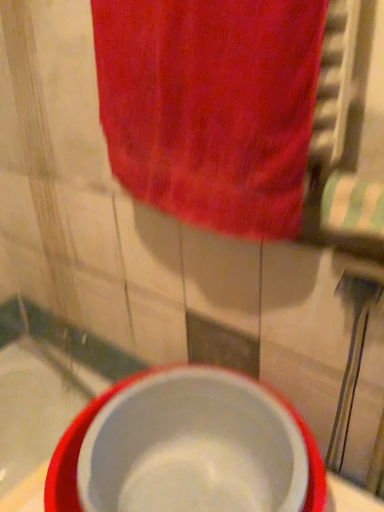
This screenshot has width=384, height=512. What do you see at coordinates (186, 449) in the screenshot? I see `white plastic basin at center` at bounding box center [186, 449].

The width and height of the screenshot is (384, 512). In order to click on red cotton towel at upper center in this screenshot , I will do pos(211,106).

From the image's perspective, between white plastic basin at center and white glossy bath at lower left, who is located below?

white plastic basin at center, from the image's perspective.

Does white plastic basin at center have a greater height compared to white glossy bath at lower left?

Yes, white plastic basin at center is taller than white glossy bath at lower left.

From a real-world perspective, is white plastic basin at center physically located above or below white glossy bath at lower left?

From a real-world perspective, white plastic basin at center is physically above white glossy bath at lower left.

Measure the distance between white plastic basin at center and white glossy bath at lower left.

They are 24.67 inches apart.

Consider the image. Considering the relative sizes of white glossy bath at lower left and red cotton towel at upper center in the image provided, is white glossy bath at lower left thinner than red cotton towel at upper center?

Incorrect, the width of white glossy bath at lower left is not less than that of red cotton towel at upper center.

Is white glossy bath at lower left positioned with its back to red cotton towel at upper center?

No, white glossy bath at lower left is not facing the opposite direction of red cotton towel at upper center.

From a real-world perspective, does white glossy bath at lower left sit lower than red cotton towel at upper center?

Indeed, from a real-world perspective, white glossy bath at lower left is positioned beneath red cotton towel at upper center.

Is white glossy bath at lower left to the right of red cotton towel at upper center from the viewer's perspective?

In fact, white glossy bath at lower left is to the left of red cotton towel at upper center.

Does point (222, 511) come in front of point (94, 22)?

No, it is not.

Is white plastic basin at center taller or shorter than red cotton towel at upper center?

Considering their sizes, white plastic basin at center has less height than red cotton towel at upper center.

Considering the sizes of white plastic basin at center and red cotton towel at upper center in the image, is white plastic basin at center wider or thinner than red cotton towel at upper center?

In the image, white plastic basin at center appears to be wider than red cotton towel at upper center.

From a real-world perspective, does white plastic basin at center sit lower than red cotton towel at upper center?

Yes, from a real-world perspective, white plastic basin at center is under red cotton towel at upper center.

Is red cotton towel at upper center not within white glossy bath at lower left?

Yes.

From the picture: Is red cotton towel at upper center positioned with its back to white glossy bath at lower left?

No, white glossy bath at lower left is not at the back of red cotton towel at upper center.

Considering the sizes of objects red cotton towel at upper center and white glossy bath at lower left in the image provided, who is bigger, red cotton towel at upper center or white glossy bath at lower left?

white glossy bath at lower left.

Are red cotton towel at upper center and white glossy bath at lower left making contact?

red cotton towel at upper center and white glossy bath at lower left are not in contact.

From a real-world perspective, is white glossy bath at lower left physically located above or below white plastic basin at center?

In terms of real-world spatial position, white glossy bath at lower left is below white plastic basin at center.

Does white glossy bath at lower left have a larger size compared to white plastic basin at center?

Actually, white glossy bath at lower left might be smaller than white plastic basin at center.

Relative to white plastic basin at center, is white glossy bath at lower left in front or behind?

Clearly, white glossy bath at lower left is behind white plastic basin at center.

There is a white plastic basin at center. Find the location of `towel above it (from a real-world perspective)`. towel above it (from a real-world perspective) is located at coordinates (211, 106).

In the scene shown: Is red cotton towel at upper center oriented away from white plastic basin at center?

No, red cotton towel at upper center is not facing the opposite direction of white plastic basin at center.

Which of these two, red cotton towel at upper center or white plastic basin at center, stands shorter?

With less height is white plastic basin at center.

Is the position of red cotton towel at upper center less distant than that of white plastic basin at center?

Yes, the depth of red cotton towel at upper center is less than that of white plastic basin at center.

This screenshot has height=512, width=384. I want to click on basin that appears in front of the white glossy bath at lower left, so click(x=186, y=449).

At what (x,y) coordinates should I click in order to perform the action: click on towel on the right of white glossy bath at lower left. Please return your answer as a coordinate pair (x, y). Looking at the image, I should click on (211, 106).

Based on their spatial positions, is white glossy bath at lower left or red cotton towel at upper center closer to white plastic basin at center?

The object closer to white plastic basin at center is red cotton towel at upper center.

Looking at the image, which one is located further to red cotton towel at upper center, white plastic basin at center or white glossy bath at lower left?

white glossy bath at lower left.

Considering their positions, is white glossy bath at lower left positioned further to red cotton towel at upper center than white plastic basin at center?

white glossy bath at lower left lies further to red cotton towel at upper center than the other object.

Which object lies further to the anchor point white plastic basin at center, red cotton towel at upper center or white glossy bath at lower left?

Among the two, white glossy bath at lower left is located further to white plastic basin at center.

From the image, which object appears to be farther from white glossy bath at lower left, red cotton towel at upper center or white plastic basin at center?

red cotton towel at upper center is positioned further to the anchor white glossy bath at lower left.

When comparing their distances from white glossy bath at lower left, does white plastic basin at center or red cotton towel at upper center seem further?

Among the two, red cotton towel at upper center is located further to white glossy bath at lower left.

Where is `basin between red cotton towel at upper center and white glossy bath at lower left in the front-back direction`? basin between red cotton towel at upper center and white glossy bath at lower left in the front-back direction is located at coordinates (186, 449).